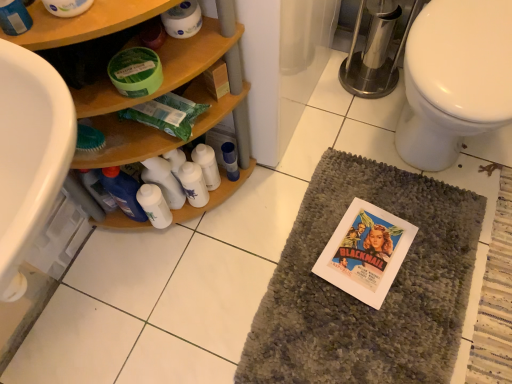
At what (x,y) coordinates should I click in order to perform the action: click on empty space that is to the right of woodenmaterial/texturebathroom cabinet at left. Please return your answer as a coordinate pair (x, y). The width and height of the screenshot is (512, 384). Looking at the image, I should click on (291, 208).